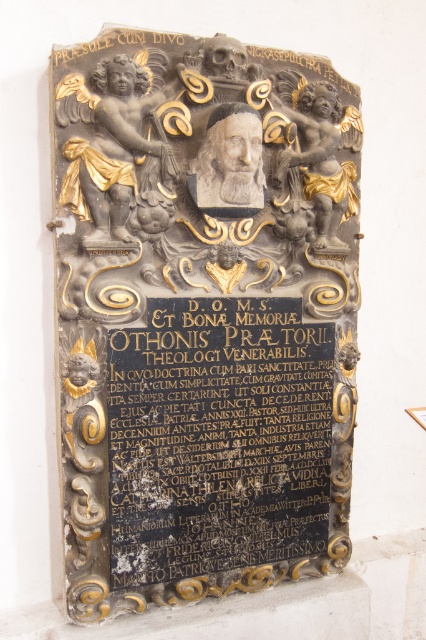
Question: Observing the image, what is the correct spatial positioning of black polished stone plaque at center in reference to gray stone bust at center?

Choices:
 (A) below
 (B) above

Answer: (A)

Question: Does gold/gilded cherub at upper right have a larger size compared to gray stone bust at center?

Choices:
 (A) no
 (B) yes

Answer: (B)

Question: Which point is farther from the camera taking this photo?

Choices:
 (A) (141, 202)
 (B) (311, 129)
 (C) (118, 172)

Answer: (B)

Question: Can you confirm if matte stone plaque at center is positioned below black polished stone plaque at center?

Choices:
 (A) no
 (B) yes

Answer: (A)

Question: Which of the following is the farthest from the observer?

Choices:
 (A) (305, 192)
 (B) (143, 196)
 (C) (152, 563)

Answer: (A)

Question: Which object is positioned farthest from the matte stone plaque at center?

Choices:
 (A) gold/gilded cherub at upper right
 (B) gray stone bust at center
 (C) gold/gilded cherub at upper left
 (D) black polished stone plaque at center

Answer: (B)